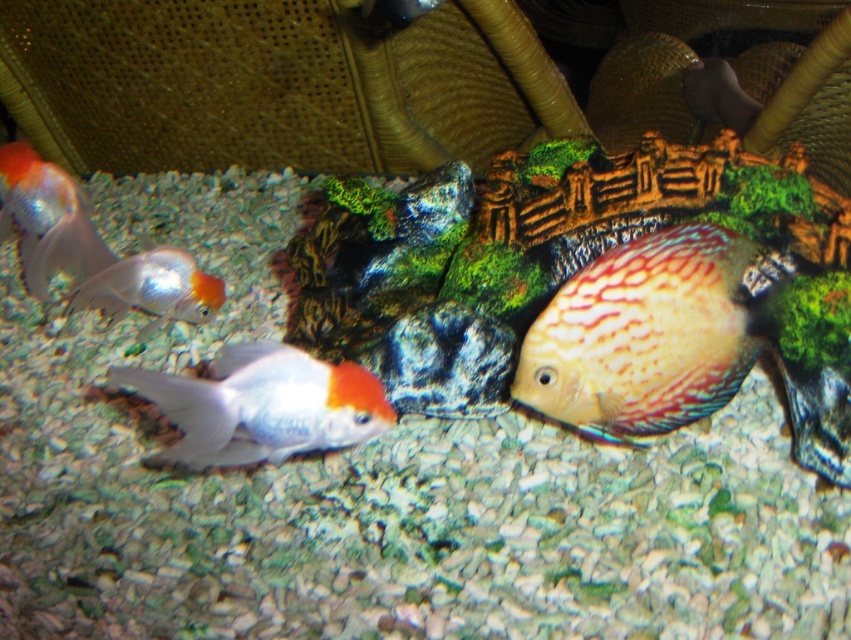
Question: Does white glossy goldfish at center have a larger size compared to shiny orange and white fish at left?

Choices:
 (A) no
 (B) yes

Answer: (A)

Question: Can you confirm if white glossy goldfish at center is bigger than shiny orange and white fish at left?

Choices:
 (A) yes
 (B) no

Answer: (B)

Question: Among these points, which one is farthest from the camera?

Choices:
 (A) (186, 294)
 (B) (52, 244)

Answer: (A)

Question: Estimate the real-world distances between objects in this image. Which object is farther from the shiny metallic goldfish at left?

Choices:
 (A) shiny orange and white fish at left
 (B) multicolored textured discus at center

Answer: (B)

Question: Which is nearer to the shiny metallic goldfish at left?

Choices:
 (A) shiny orange and white fish at left
 (B) multicolored textured discus at center

Answer: (A)

Question: Does multicolored textured discus at center appear on the left side of shiny orange and white fish at left?

Choices:
 (A) yes
 (B) no

Answer: (B)